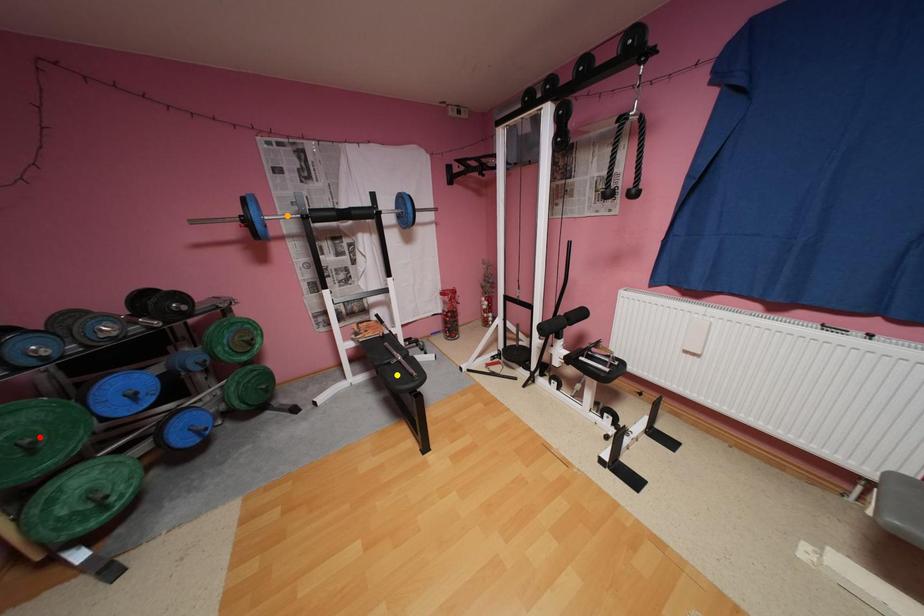
Order these from farthest to nearest:
- yellow point
- orange point
- red point

yellow point
orange point
red point